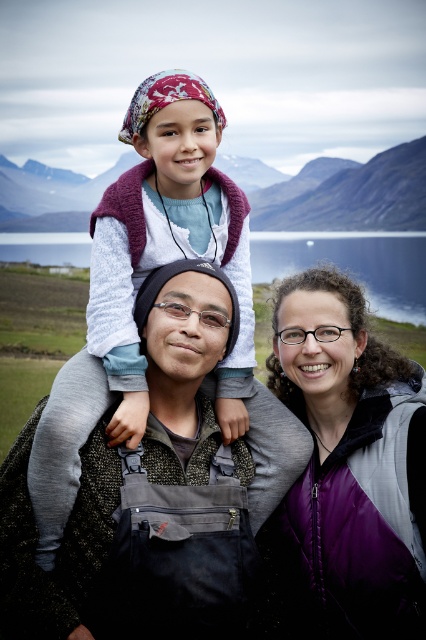
Question: Which of these objects is positioned closest to the knitted purple vest at center?

Choices:
 (A) blue water at center
 (B) dark gray fabric at center
 (C) purple fleece vest at center

Answer: (B)

Question: Which of these objects is positioned closest to the purple fleece vest at center?

Choices:
 (A) blue water at center
 (B) knitted purple vest at center
 (C) dark gray fabric at center

Answer: (C)

Question: Considering the relative positions of purple fleece vest at center and knitted purple vest at center in the image provided, where is purple fleece vest at center located with respect to knitted purple vest at center?

Choices:
 (A) above
 (B) below

Answer: (B)

Question: Observing the image, what is the correct spatial positioning of purple fleece vest at center in reference to knitted purple vest at center?

Choices:
 (A) right
 (B) left

Answer: (A)

Question: Is dark gray fabric at center bigger than purple fleece vest at center?

Choices:
 (A) yes
 (B) no

Answer: (A)

Question: Considering the real-world distances, which object is farthest from the knitted purple vest at center?

Choices:
 (A) blue water at center
 (B) dark gray fabric at center
 (C) purple fleece vest at center

Answer: (A)